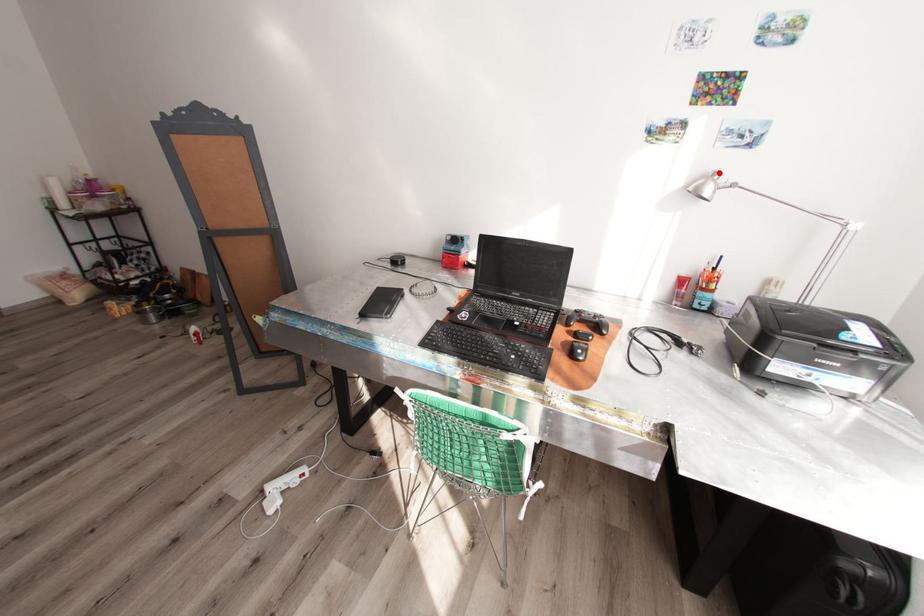
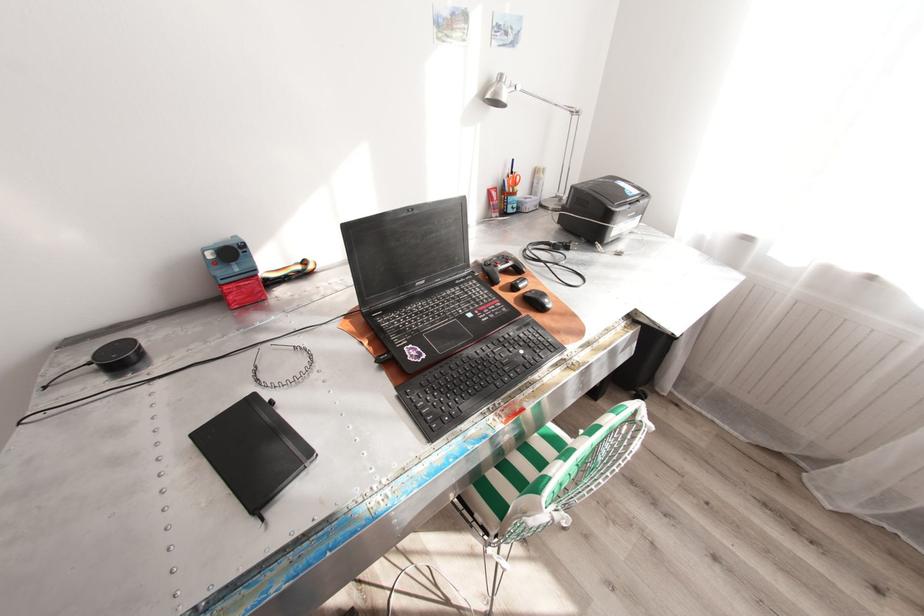
The point at the highlighted location is marked in the first image. Where is the corresponding point in the second image?

(505, 76)